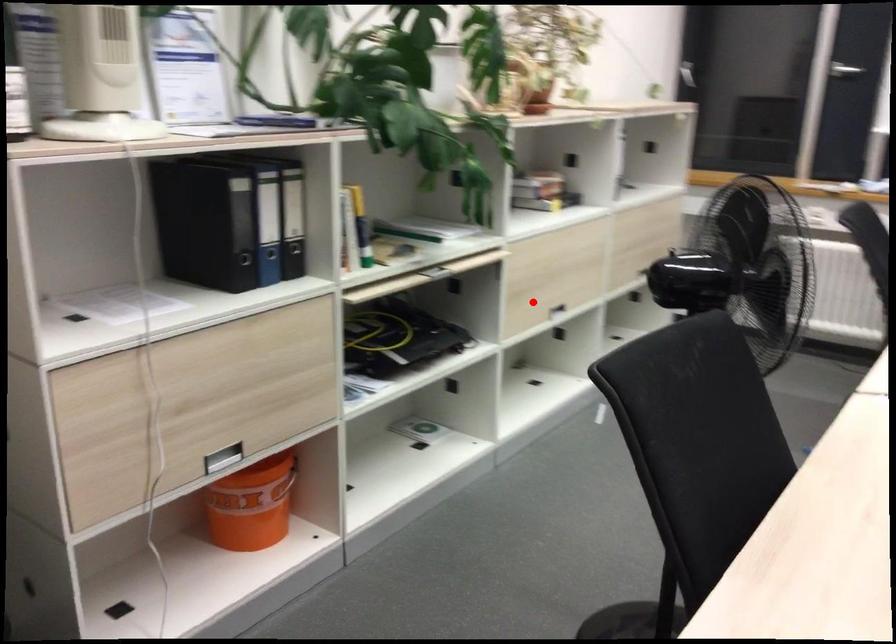
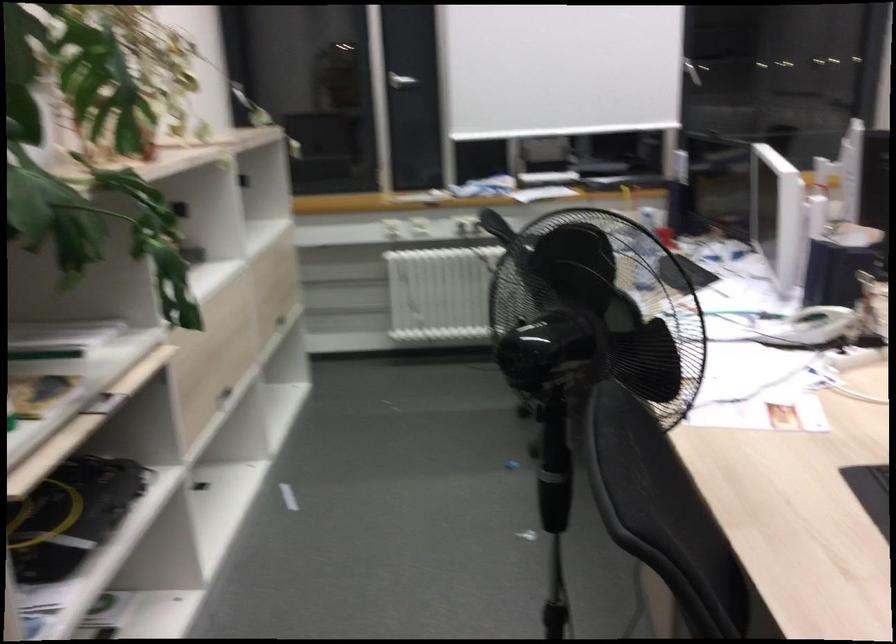
The point at the highlighted location is marked in the first image. Where is the corresponding point in the second image?

(211, 395)